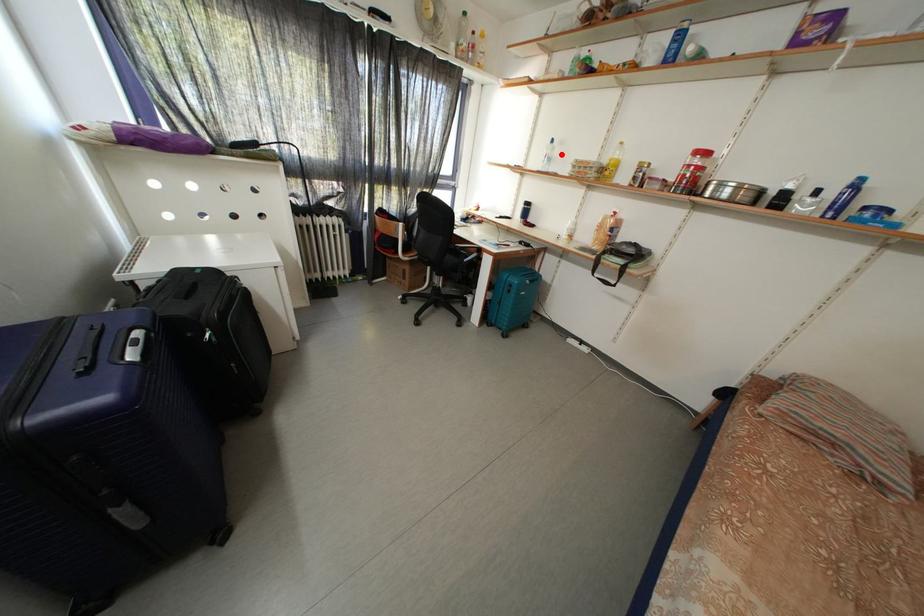
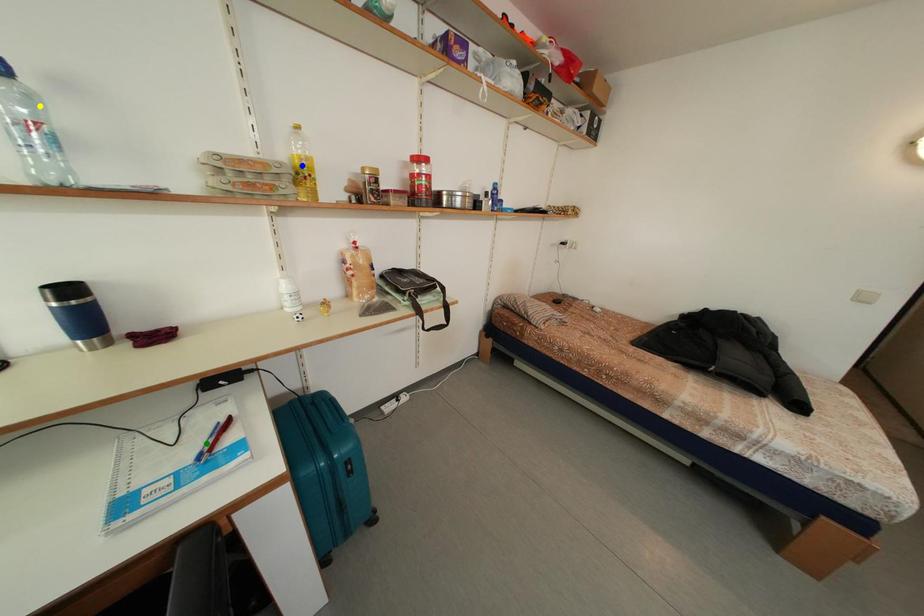
Question: I am providing you with two images of the same scene from different viewpoints. A red point is marked on the first image. You are given multiple points on the second image. In image 2, which mark is for the same physical point as the one in image 1?

Choices:
 (A) blue point
 (B) green point
 (C) yellow point

Answer: (C)